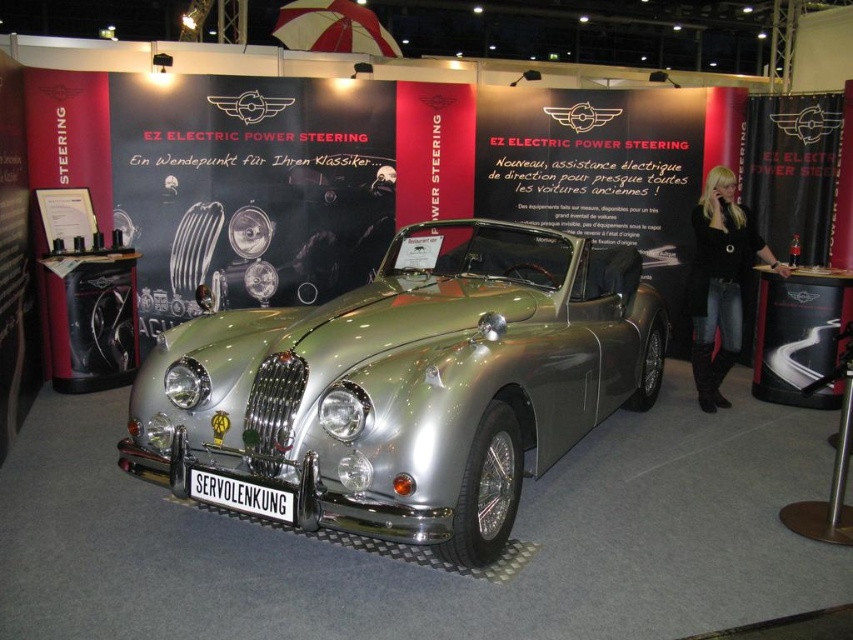
Question: Does silver metallic car at center come in front of black metal sign at center?

Choices:
 (A) no
 (B) yes

Answer: (B)

Question: Observing the image, what is the correct spatial positioning of silver metallic car at center in reference to black metal sign at center?

Choices:
 (A) below
 (B) above

Answer: (B)

Question: Which point is farther to the camera?

Choices:
 (A) black metal sign at center
 (B) silver metallic car at center

Answer: (A)

Question: Does silver metallic car at center come behind black metal sign at center?

Choices:
 (A) no
 (B) yes

Answer: (A)

Question: Which of the following is the farthest from the observer?

Choices:
 (A) tap(219, 497)
 (B) tap(502, 268)

Answer: (B)